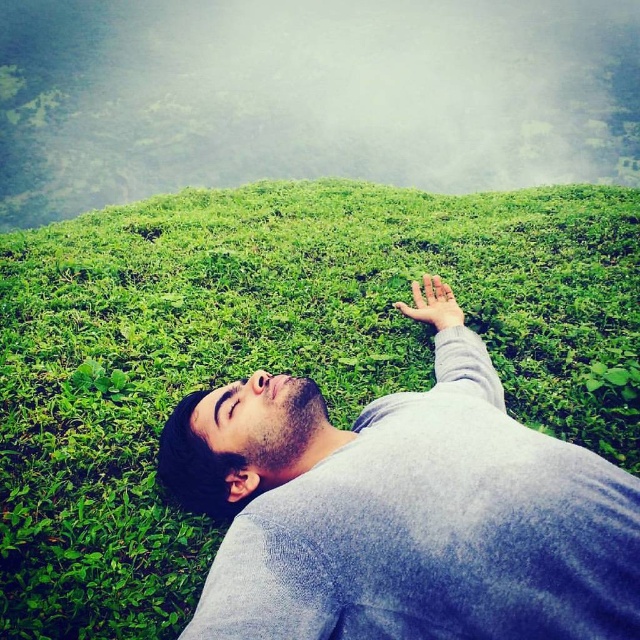
You are a photographer trying to capture the scene of a person lying on a hillside. You notice the gray cotton shirt at center and the matte skin hand at upper center. Which object should you focus on first if you want to capture the one that is higher in the frame?

The gray cotton shirt at center is taller than the matte skin hand at upper center, so you should focus on the gray cotton shirt at center first since it is higher in the frame.

You are a photographer capturing the scene of a person lying on a lush green hillside. You notice a point at coordinates (403, 515). What object is located at that point?

The point at coordinates (403, 515) indicates the gray cotton shirt at center.